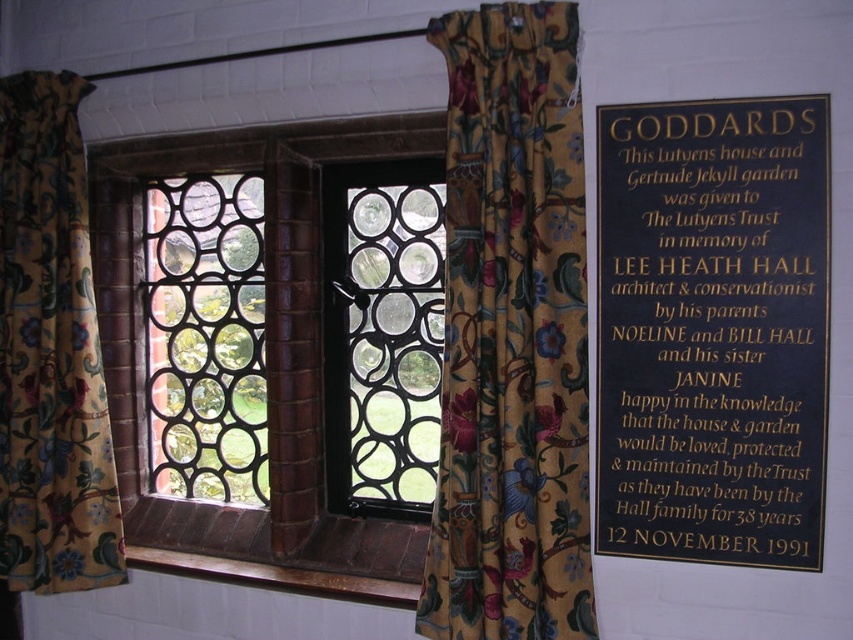
Who is taller, floral-patterned fabric at center or black metal/texture at center?

floral-patterned fabric at center

The height and width of the screenshot is (640, 853). Identify the location of floral-patterned fabric at center. (512, 336).

In order to click on floral-patterned fabric at center in this screenshot , I will do `click(512, 336)`.

Is black ironwork window at center positioned before floral fabric curtain at left?

Yes, black ironwork window at center is closer to the viewer.

Where is `black ironwork window at center`? black ironwork window at center is located at coordinates (265, 358).

I want to click on black ironwork window at center, so click(x=265, y=358).

Who is higher up, black ironwork window at center or black metal/texture at center?

Positioned higher is black metal/texture at center.

Who is more forward, (94, 163) or (234, 464)?

Point (94, 163) is in front.

Identify the location of black ironwork window at center. coord(265,358).